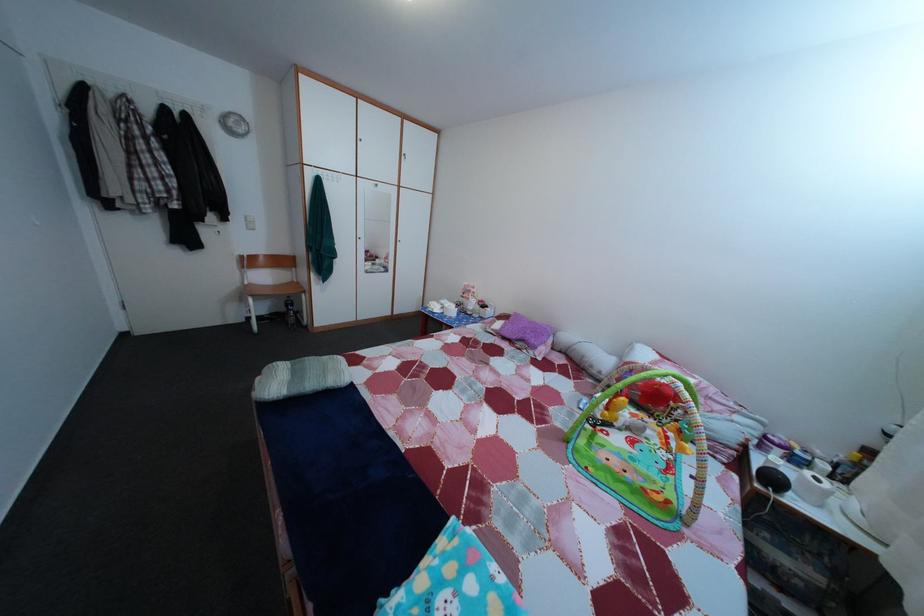
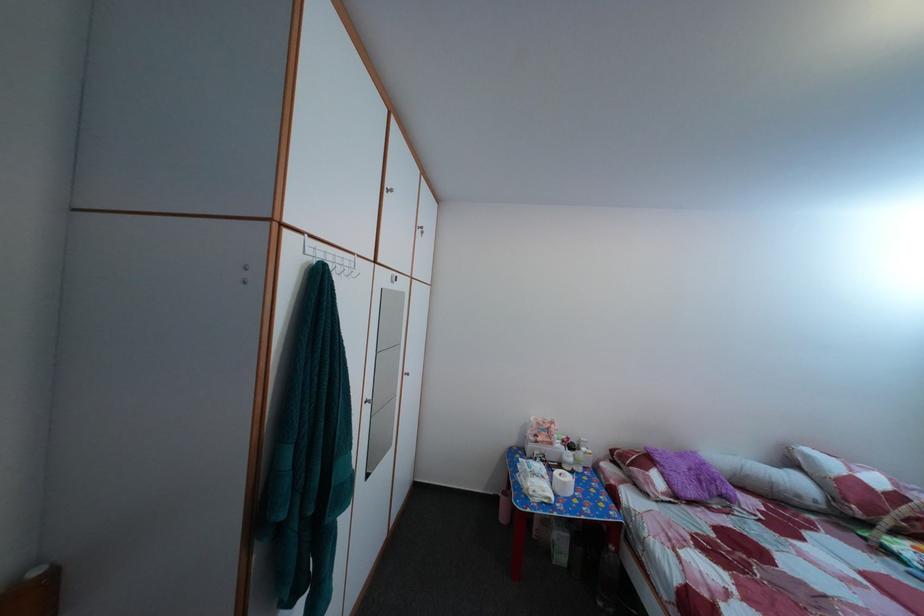
Locate, in the second image, the point that corresponds to (x=641, y=357) in the first image.

(817, 464)